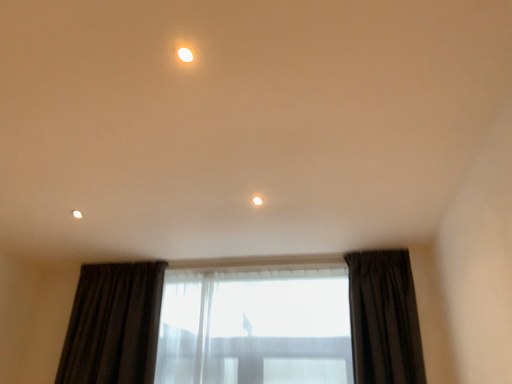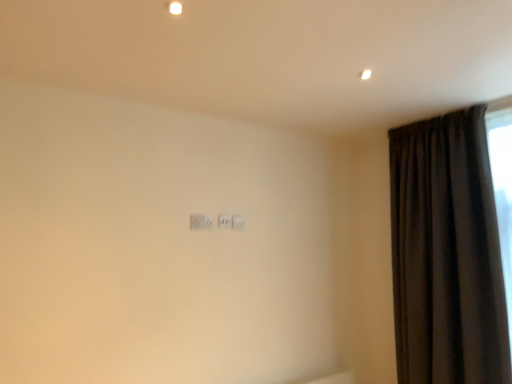
Question: How did the camera likely rotate when shooting the video?

Choices:
 (A) rotated right
 (B) rotated left

Answer: (B)